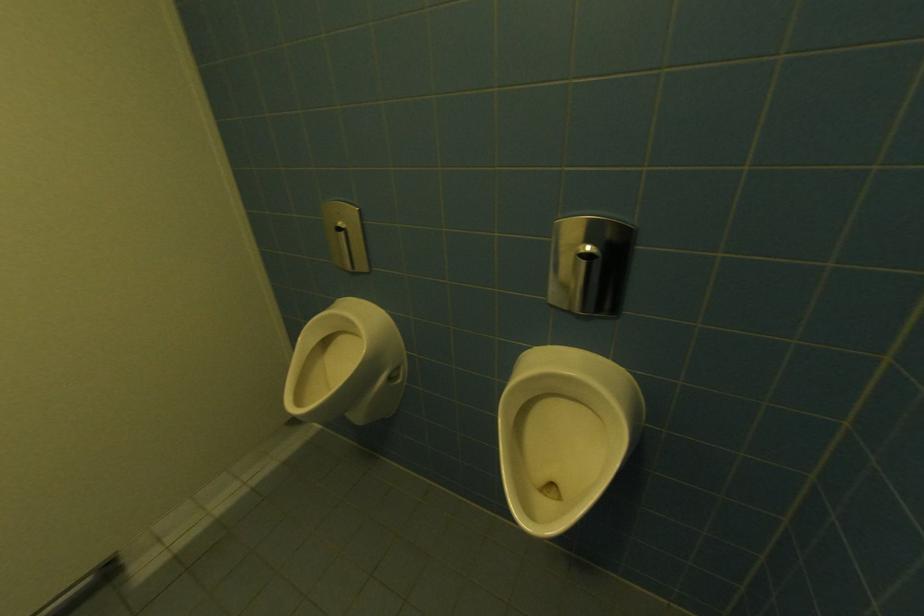
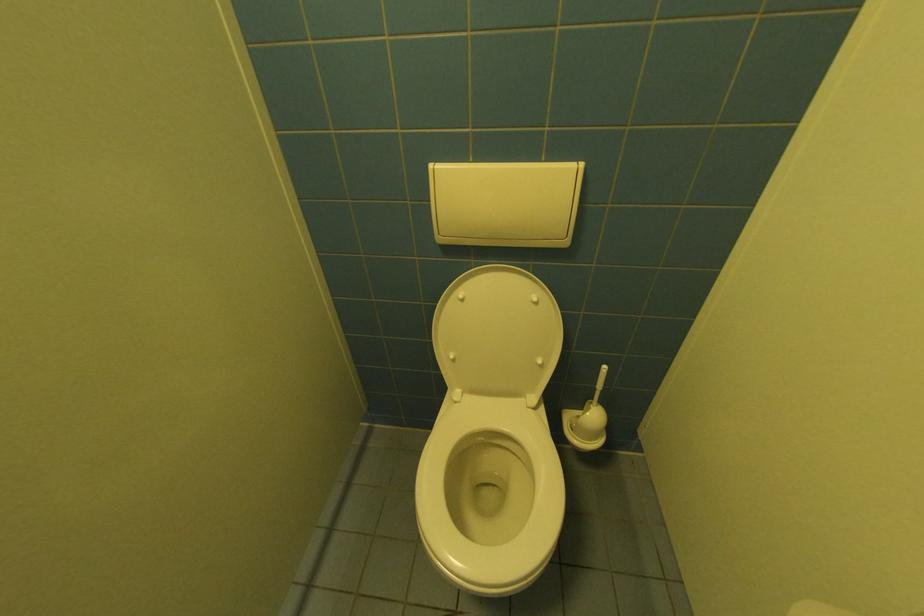
In a continuous first-person perspective shot, in which direction is the camera moving?

The cameraman moved toward left, forward.